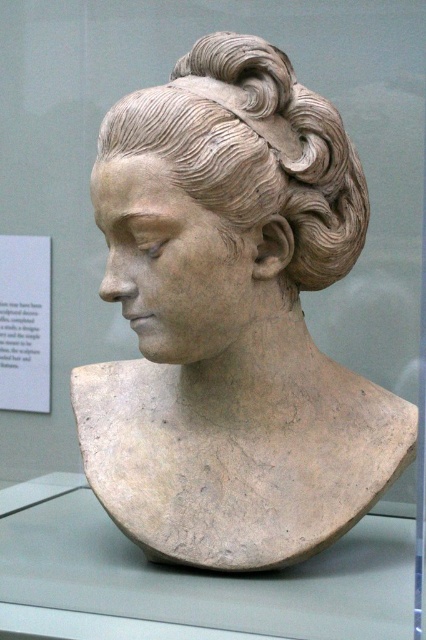
You are an art student observing the classical bust sculpture. You notice the matte clay bust at center and the matte clay hair bun at center. Which one is positioned lower in the sculpture?

The matte clay bust at center is positioned below the matte clay hair bun at center, so the matte clay bust at center is lower in the sculpture.

You are standing in front of a classical bust sculpture of a woman. You want to place a small decorative item exactly at the point labeled point (118,148) on the sculpture. If your hand is 1.5 meters long, can you reach that point without moving closer to the sculpture?

The point (118,148) is 1.38 meters from the camera. Since your hand is 1.5 meters long, you can reach the point without moving closer.

You are an art restorer working on a classical bust sculpture. You need to ensure the spacing between the matte clay bust at center and the matte clay hair bun at center is at least 7 centimeters to prevent damage during transportation. Based on the image, is the current spacing sufficient?

The matte clay bust at center is 6.57 centimeters from the matte clay hair bun at center, which is less than the required 7 centimeters. The current spacing is insufficient to prevent damage during transportation.